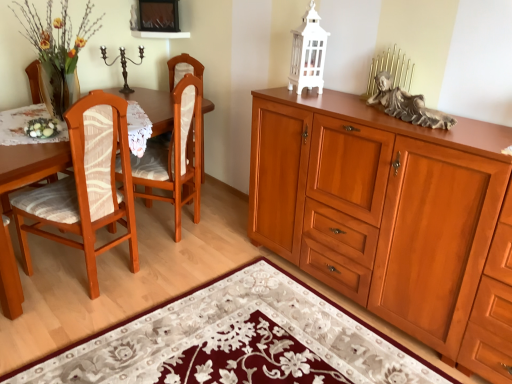
Question: From a real-world perspective, is wooden chair at left, arranged as the 1th chair when viewed from the back, physically located above or below floral rug at lower center?

Choices:
 (A) above
 (B) below

Answer: (A)

Question: Considering the positions of wooden chair at left, arranged as the 1th chair when viewed from the back, and floral rug at lower center in the image, is wooden chair at left, arranged as the 1th chair when viewed from the back, taller or shorter than floral rug at lower center?

Choices:
 (A) tall
 (B) short

Answer: (A)

Question: Considering the real-world distances, which object is farthest from the white lace tablecloth at left?

Choices:
 (A) wooden chair at left, placed as the first chair when sorted from front to back
 (B) gray stone statue at upper right
 (C) wooden cabinet at right
 (D) wooden chair at left, arranged as the 1th chair when viewed from the back
 (E) floral rug at lower center

Answer: (B)

Question: Estimate the real-world distances between objects in this image. Which object is farther from the wooden chair at left, placed as the first chair when sorted from front to back?

Choices:
 (A) wooden cabinet at right
 (B) gray stone statue at upper right
 (C) wooden chair at left, which is the 2th chair from front to back
 (D) floral rug at lower center
 (E) white lace tablecloth at left

Answer: (B)